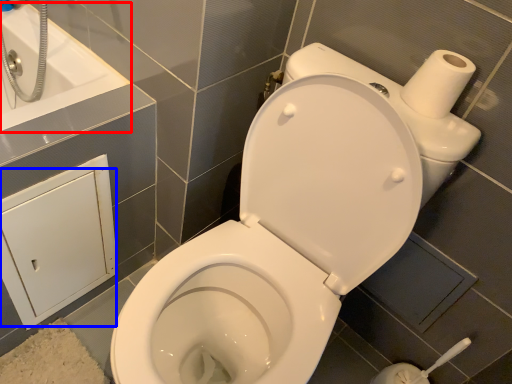
Question: Which point is closer to the camera, bath (highlighted by a red box) or screen door (highlighted by a blue box)?

Choices:
 (A) bath
 (B) screen door

Answer: (B)